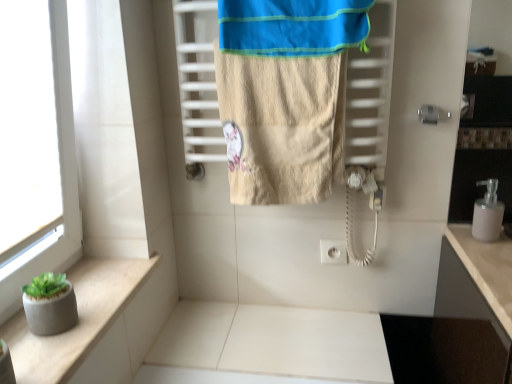
Question: Is blue cotton beach towel at upper center bigger or smaller than beige textured towel at center?

Choices:
 (A) small
 (B) big

Answer: (A)

Question: From the image's perspective, is blue cotton beach towel at upper center positioned above or below beige textured towel at center?

Choices:
 (A) below
 (B) above

Answer: (B)

Question: Estimate the real-world distances between objects in this image. Which object is farther from the concrete planter at lower left?

Choices:
 (A) pink matte soap dispenser at right
 (B) blue cotton beach towel at upper center
 (C) beige textured towel at center

Answer: (A)

Question: Estimate the real-world distances between objects in this image. Which object is farther from the beige textured towel at center?

Choices:
 (A) pink matte soap dispenser at right
 (B) blue cotton beach towel at upper center
 (C) concrete planter at lower left

Answer: (A)